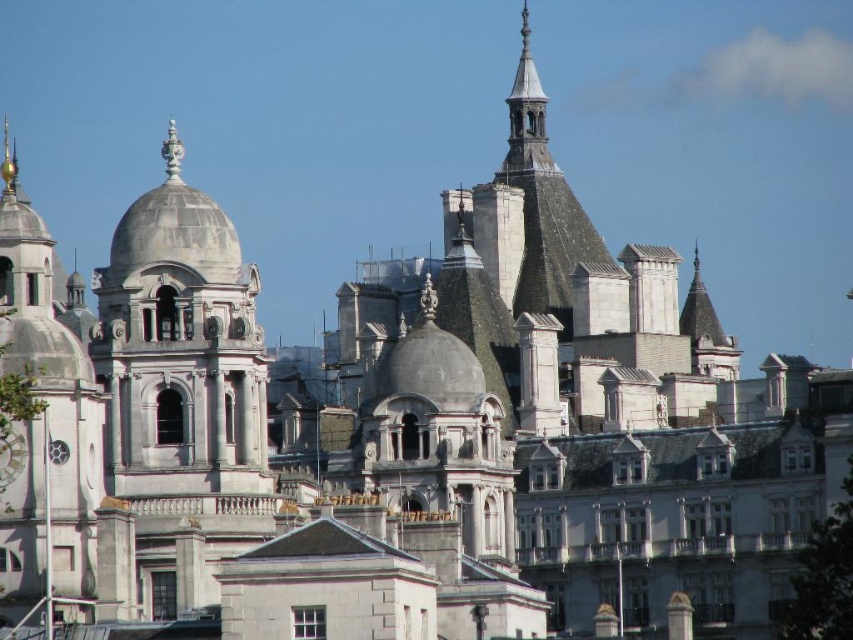
In the scene shown: Who is more forward, (32, 492) or (22, 438)?

Positioned in front is point (32, 492).

From the picture: Is white stone clock tower at left wider than white marble clock at center?

Correct, the width of white stone clock tower at left exceeds that of white marble clock at center.

Find the location of a particular element. This screenshot has height=640, width=853. white stone clock tower at left is located at coordinates (45, 428).